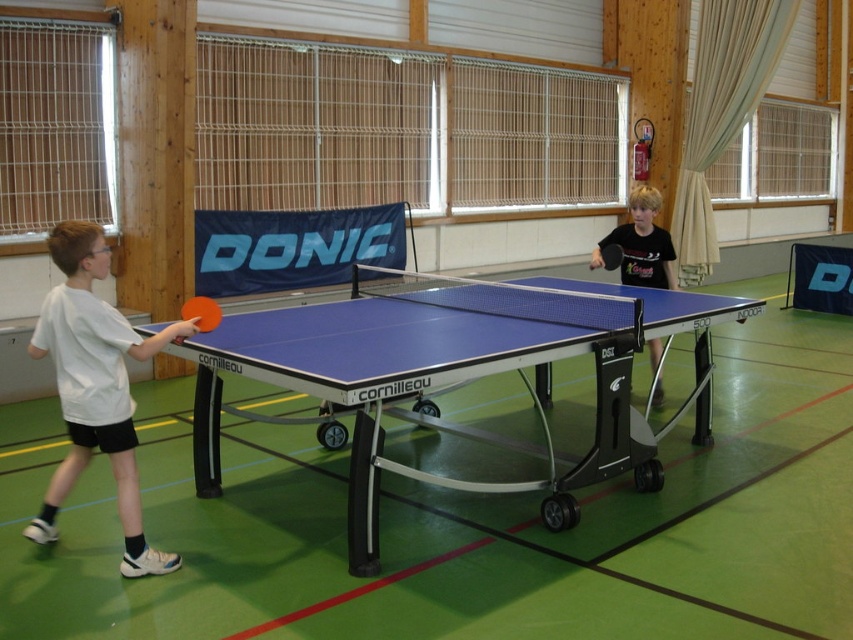
You are a referee at a table tennis match. You need to ensure all paddles comply with regulations. The rules state that the paddle must not exceed 16 cm in height. You see the black matte ping pong paddle at right and the rubber paddle at center. Which paddle is more likely to be compliant with the height requirement?

The rubber paddle at center is more likely to be compliant with the height requirement since the black matte ping pong paddle at right is taller than it, and the regulation limit is 16 cm.

You are a photographer setting up for a table tennis match. You need to place two markers at the positions of point (621, 276) and point (190, 317). Which marker will be closer to the camera?

Point (190, 317) will be closer to the camera since it is less further than point (621, 276) according to the description.